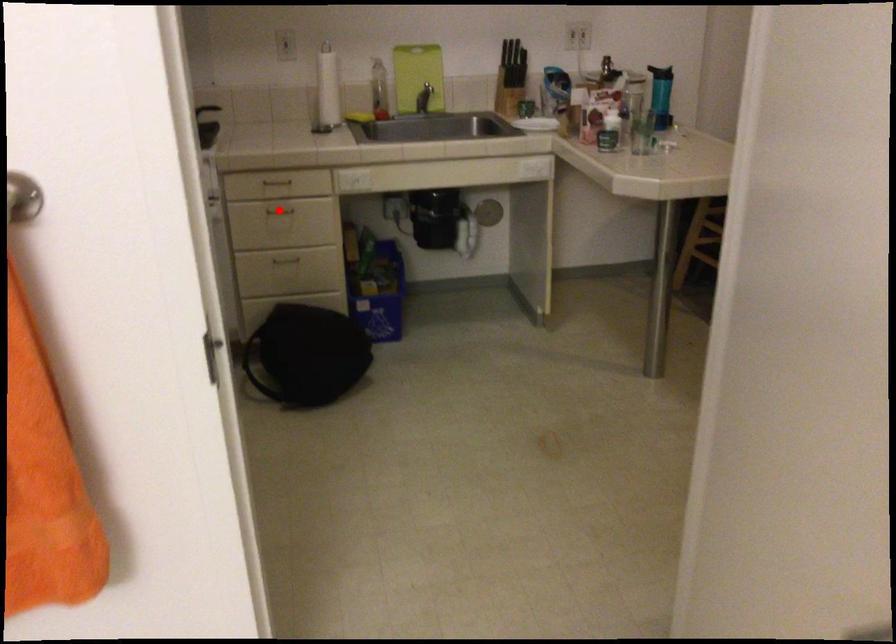
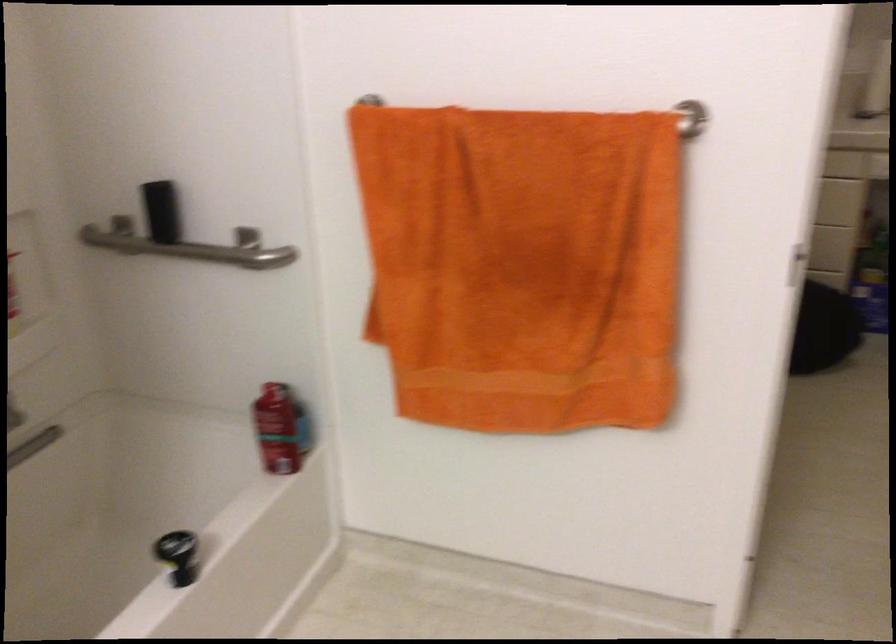
Question: I am providing you with two images of the same scene from different viewpoints. A red point is marked on the first image. At the location where the point appears in image 1, is it still visible in image 2?

Choices:
 (A) Yes
 (B) No

Answer: (B)